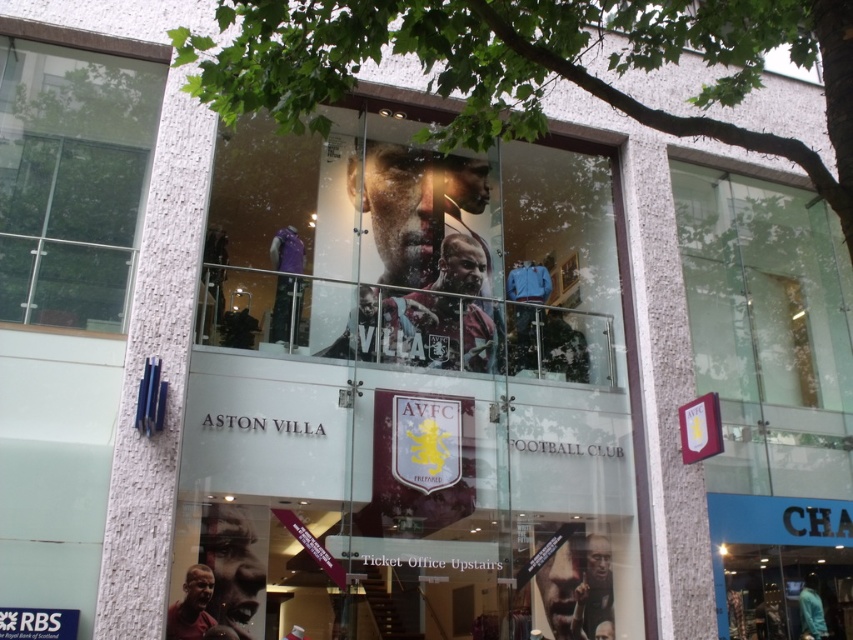
You are a customer standing outside the Aston Villa Football Club store. You notice the maroon fabric banner at lower right and the clear glass window at upper left. Which object is narrower in width?

The maroon fabric banner at lower right has a lesser width compared to the clear glass window at upper left, so the maroon fabric banner at lower right is narrower in width.

You are standing in front of the Aston Villa Football Club merchandise store. The store has a large glass facade with a logo and a poster. There is a specific point at coordinates point (x=413, y=250). What object is located at that point?

The point (x=413, y=250) corresponds to the matte glass poster at center.